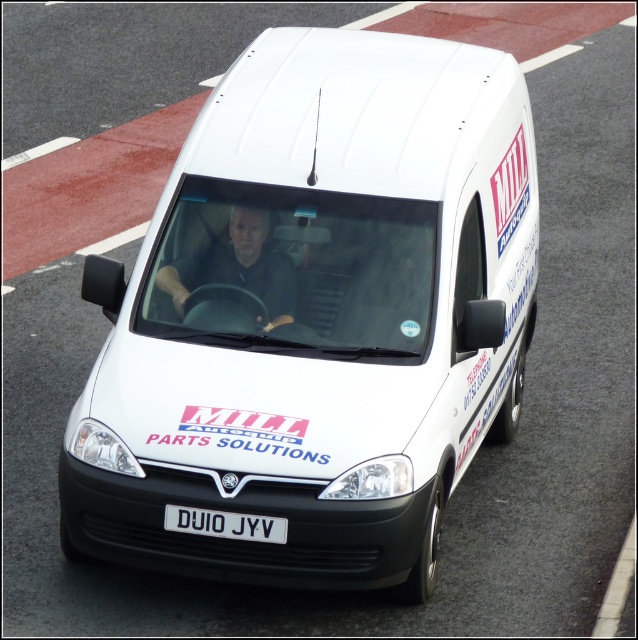
You are a pedestrian standing on the sidewalk next to the road where the white matte van at center and the white plastic license plate at center are located. Which object is positioned higher from the ground?

The white matte van at center is positioned higher from the ground than the white plastic license plate at center, as it is above it.

You are a passenger sitting in the back seat of the white van. You want to take a photo of the matte black steering wheel at center using your camera. Do you think your camera can capture the steering wheel clearly if it has a maximum focus range of 7 meters?

The matte black steering wheel at center and camera are 7.23 meters apart from each other. Since the camera can only focus up to 7 meters, it cannot capture the steering wheel clearly as the distance exceeds the maximum focus range.

You are a delivery person who needs to locate the white matte van at center on a map. What are the coordinates of the van?

The white matte van at center is located at point (315, 316), so the coordinates are 0.494 and 0.495.